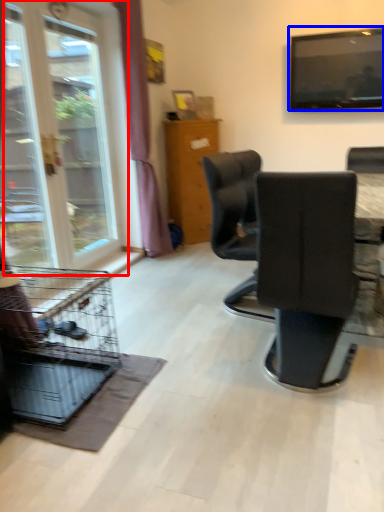
Question: Which object appears farthest to the camera in this image, window (highlighted by a red box) or television (highlighted by a blue box)?

Choices:
 (A) window
 (B) television

Answer: (B)